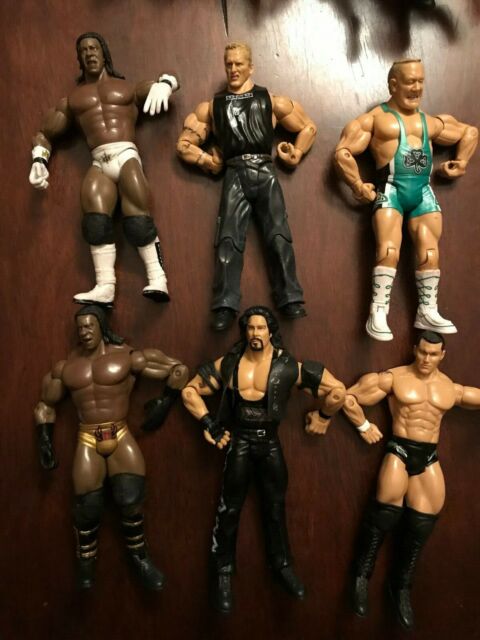
The height and width of the screenshot is (640, 480). I want to click on action figure, so click(96, 400), click(260, 388), click(426, 406), click(409, 136), click(246, 124), click(104, 104).